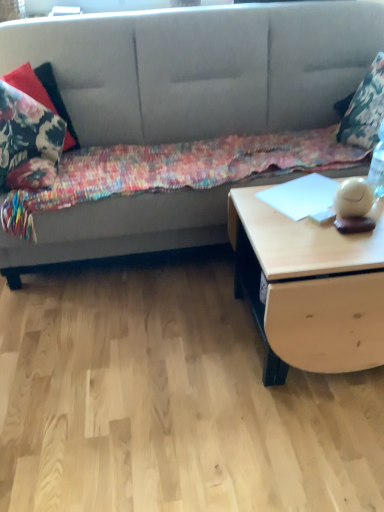
Question: From the image's perspective, is light wood/texture table at right above or below floral fabric pillow at upper right, placed as the 1th pillow when sorted from right to left?

Choices:
 (A) below
 (B) above

Answer: (A)

Question: Based on their positions, is light wood/texture table at right located to the left or right of floral fabric pillow at upper right, the 2th pillow positioned from the left?

Choices:
 (A) right
 (B) left

Answer: (B)

Question: Based on their relative distances, which object is farther from the textured gray couch at upper center?

Choices:
 (A) floral fabric blanket at center
 (B) light wood/texture table at right
 (C) floral fabric pillow at upper right, placed as the 1th pillow when sorted from right to left
 (D) floral fabric pillow at left, the second pillow positioned from the right

Answer: (B)

Question: Which of these objects is positioned farthest from the floral fabric pillow at upper right, the 2th pillow positioned from the left?

Choices:
 (A) textured gray couch at upper center
 (B) light wood/texture table at right
 (C) floral fabric blanket at center
 (D) floral fabric pillow at left, the second pillow positioned from the right

Answer: (D)